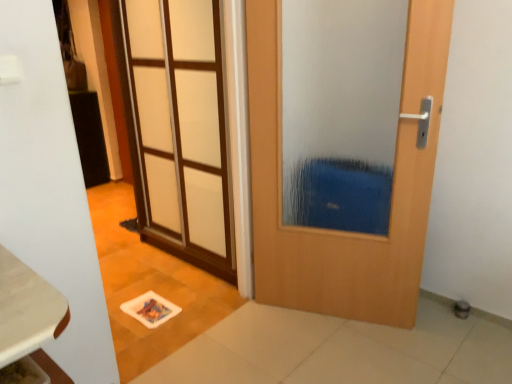
This screenshot has height=384, width=512. Identify the location of free space in front of white frosted glass door at upper left, which is counted as the 2th door, starting from the right. (168, 304).